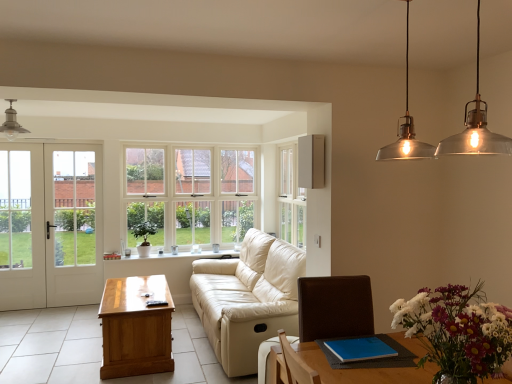
This screenshot has width=512, height=384. In order to click on free space that is to the left of light brown wooden table at left in this screenshot , I will do `click(60, 350)`.